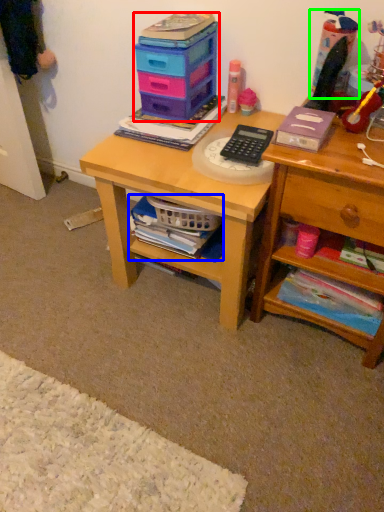
Question: Based on their relative distances, which object is nearer to storage box (highlighted by a red box)? Choose from book (highlighted by a blue box) and toy (highlighted by a green box).

Choices:
 (A) book
 (B) toy

Answer: (A)